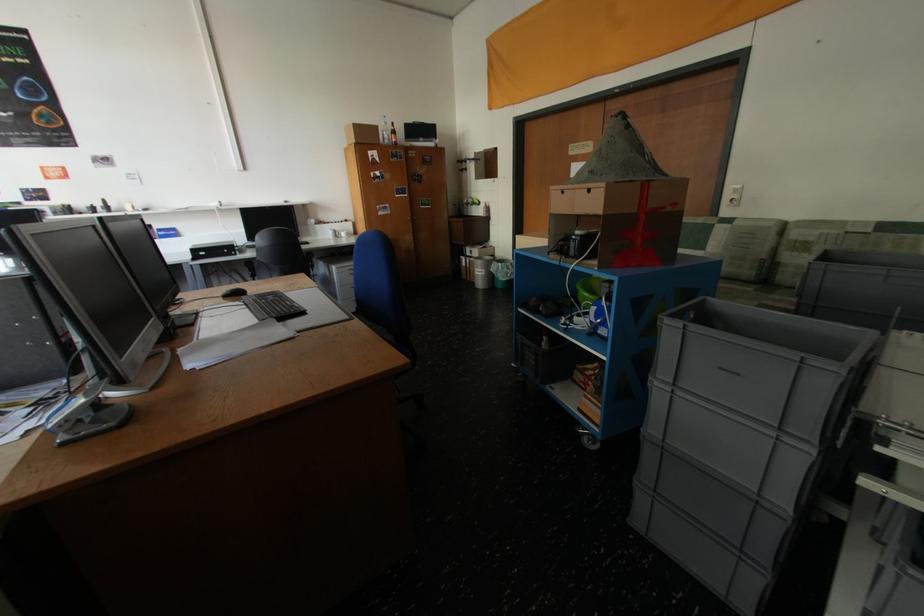
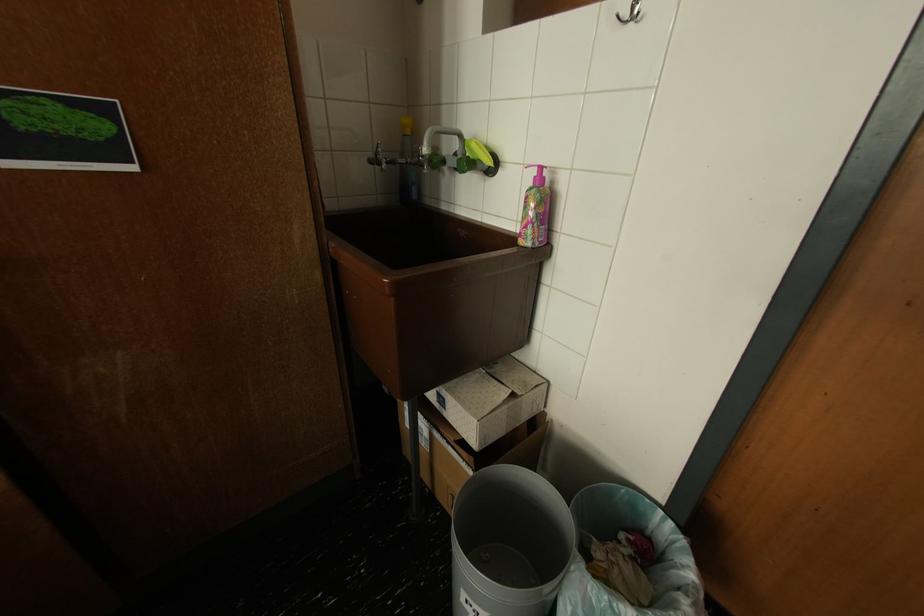
Find the pixel in the second image that matches (x=463, y=206) in the first image.

(379, 163)